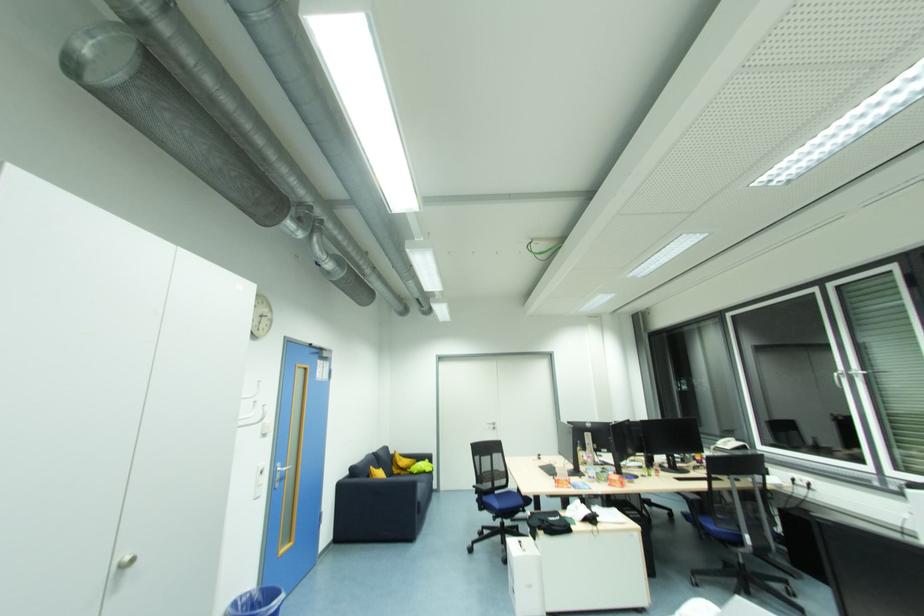
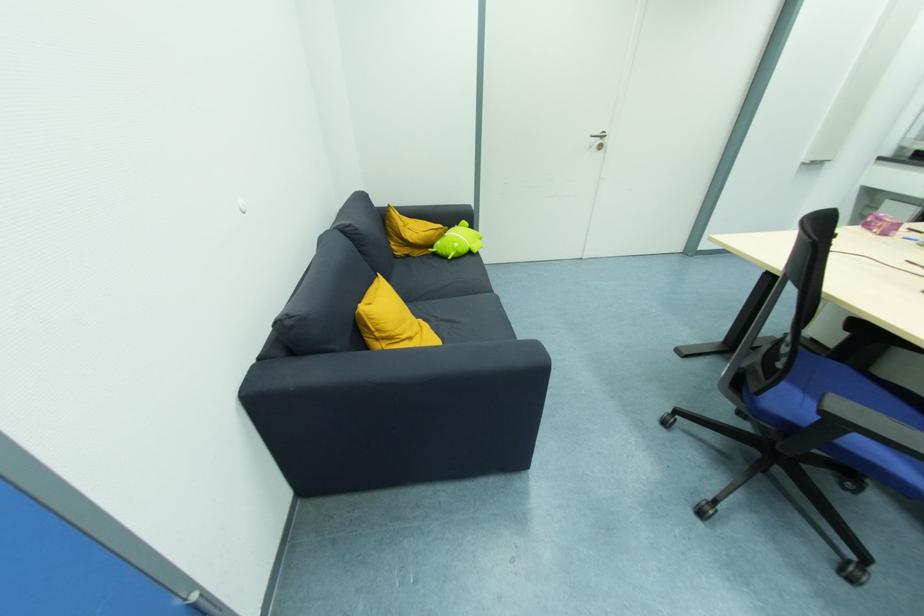
Find the pixel in the second image that matches (x=411, y=469) in the first image.

(435, 248)